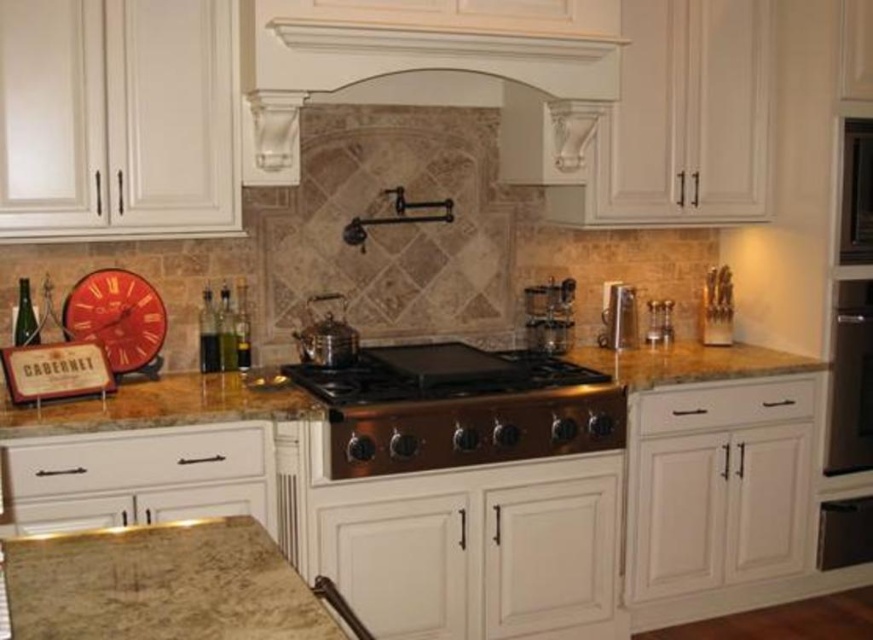
Question: In this image, where is copper/stainless steel stove at center located relative to satin black oven at right?

Choices:
 (A) right
 (B) left

Answer: (B)

Question: Is white marble exhaust hood at upper center to the left of satin nickel spice rack at center from the viewer's perspective?

Choices:
 (A) yes
 (B) no

Answer: (A)

Question: Among these objects, which one is farthest from the camera?

Choices:
 (A) brown granite countertop at center
 (B) satin nickel spice rack at center
 (C) marble countertop at lower left

Answer: (B)

Question: Estimate the real-world distances between objects in this image. Which object is farther from the brown granite countertop at center?

Choices:
 (A) white matte drawer at lower left
 (B) white matte drawer at center

Answer: (B)

Question: Which point is farther to the camera?

Choices:
 (A) copper/stainless steel stove at center
 (B) satin black oven at right
 (C) white matte drawer at lower left

Answer: (B)

Question: Does white matte drawer at lower left appear on the left side of satin nickel faucet at center?

Choices:
 (A) yes
 (B) no

Answer: (A)